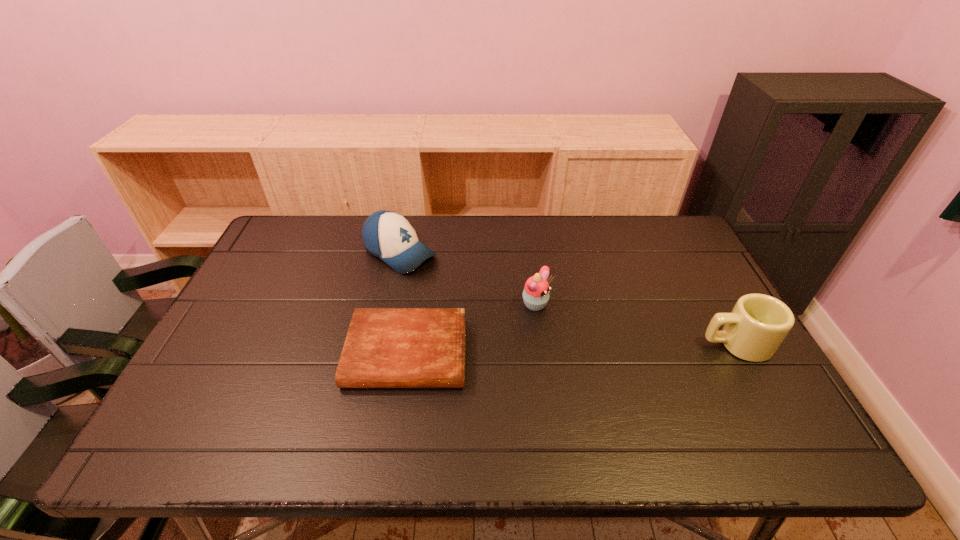
This screenshot has height=540, width=960. I want to click on the shortest object, so click(x=385, y=347).

This screenshot has height=540, width=960. Identify the location of the rightmost object. (758, 324).

Locate an element on the screen. the farthest object is located at coordinates [389, 236].

This screenshot has width=960, height=540. Find the location of `cupcake`. cupcake is located at coordinates (536, 291).

The height and width of the screenshot is (540, 960). In order to click on the second farthest object in this screenshot , I will do `click(536, 291)`.

Image resolution: width=960 pixels, height=540 pixels. I want to click on free location located on the spine side of the Bible, so click(398, 410).

At what (x,y) coordinates should I click in order to perform the action: click on vacant region located 0.070m with the handle on the side of the rightmost object. Please return your answer as a coordinate pair (x, y). Looking at the image, I should click on point(675,344).

In order to click on free space located 0.250m with the handle on the side of the rightmost object in this screenshot , I will do `click(607, 344)`.

At what (x,y) coordinates should I click in order to perform the action: click on free spot located with the handle on the side of the rightmost object. Please return your answer as a coordinate pair (x, y). The image size is (960, 540). Looking at the image, I should click on (667, 344).

What are the coordinates of `free spot located on the front-facing side of the farthest object` in the screenshot? It's located at (514, 319).